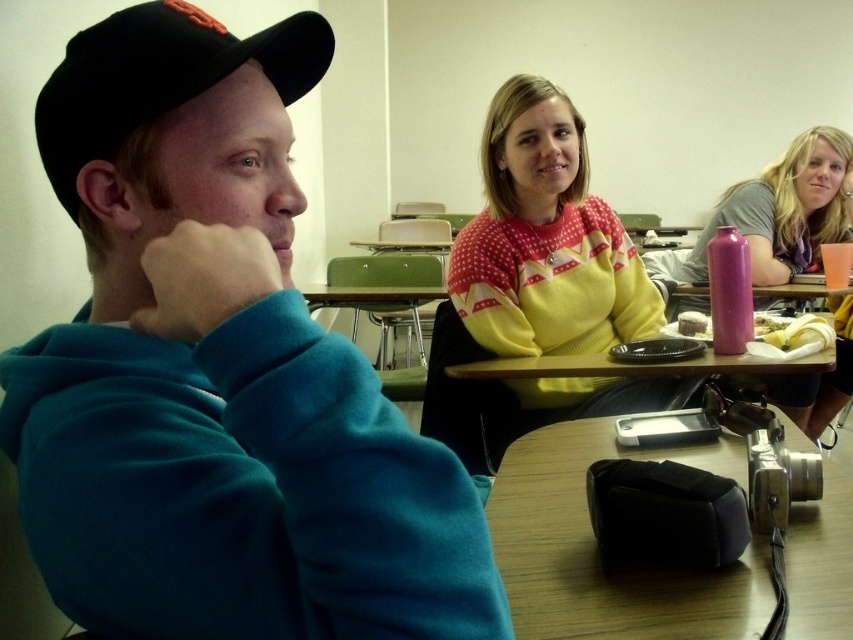
Question: Does black fabric camera at lower right have a smaller size compared to wooden table at center?

Choices:
 (A) no
 (B) yes

Answer: (B)

Question: Is teal fleece jacket at center closer to the viewer compared to pink metallic water bottle at upper right?

Choices:
 (A) yes
 (B) no

Answer: (A)

Question: Which point is farther from the camera taking this photo?

Choices:
 (A) (230, 65)
 (B) (514, 428)

Answer: (B)

Question: Which point is closer to the camera taking this photo?

Choices:
 (A) (700, 289)
 (B) (440, 355)

Answer: (B)

Question: Can you confirm if black fabric baseball cap at left is thinner than pink matte water bottle at center?

Choices:
 (A) yes
 (B) no

Answer: (A)

Question: Among these points, which one is farthest from the camera?

Choices:
 (A) (477, 456)
 (B) (804, 284)

Answer: (B)